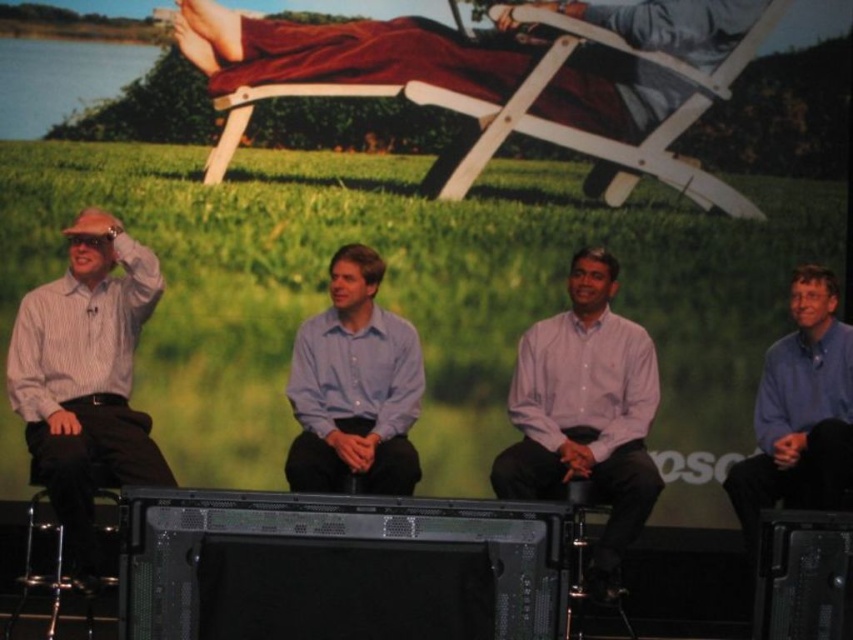
Question: Is light blue shirt at center smaller than white wood beach chair at upper center?

Choices:
 (A) yes
 (B) no

Answer: (B)

Question: Is light blue shirt at center thinner than blue shirt at right?

Choices:
 (A) yes
 (B) no

Answer: (B)

Question: Does white wood beach chair at upper center have a larger size compared to blue shirt at right?

Choices:
 (A) yes
 (B) no

Answer: (B)

Question: Which point is farther to the camera?

Choices:
 (A) (308, 360)
 (B) (444, 97)

Answer: (B)

Question: Which object is farther from the camera taking this photo?

Choices:
 (A) white wood beach chair at upper center
 (B) blue shirt at right
 (C) pink cotton shirt at center

Answer: (A)

Question: Which of these objects is positioned closest to the white wood beach chair at upper center?

Choices:
 (A) blue shirt at right
 (B) light blue shirt at center
 (C) striped cotton shirt at left

Answer: (B)